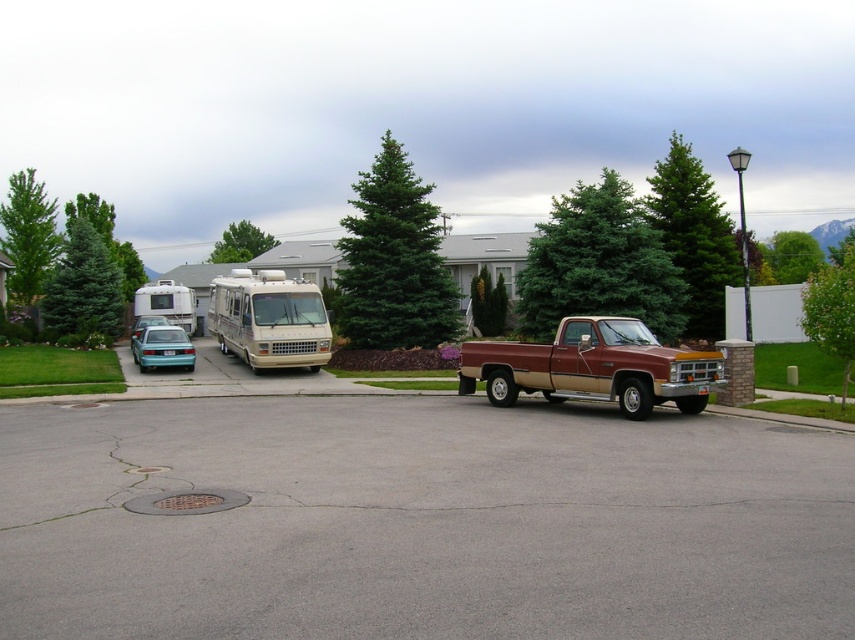
Question: Is green textured tree at upper right positioned in front of beige matte rv at center?

Choices:
 (A) yes
 (B) no

Answer: (B)

Question: Can you confirm if gray asphalt parking lot at center is positioned to the right of green leafy tree at left?

Choices:
 (A) yes
 (B) no

Answer: (A)

Question: Can you confirm if green fir tree at center is smaller than green leafy tree at left?

Choices:
 (A) yes
 (B) no

Answer: (A)

Question: Which of the following is the farthest from the observer?

Choices:
 (A) (681, 209)
 (B) (248, 310)

Answer: (A)

Question: Which point is closer to the camera?

Choices:
 (A) (805, 266)
 (B) (569, 561)
 (C) (12, 179)
 (D) (92, 202)

Answer: (B)

Question: Which point is closer to the camera?

Choices:
 (A) (143, 330)
 (B) (852, 321)

Answer: (B)